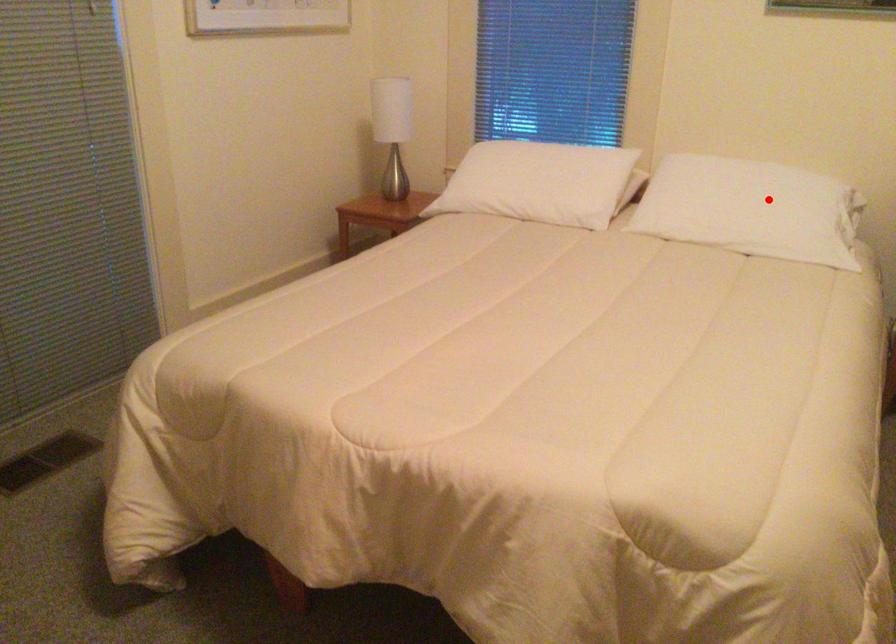
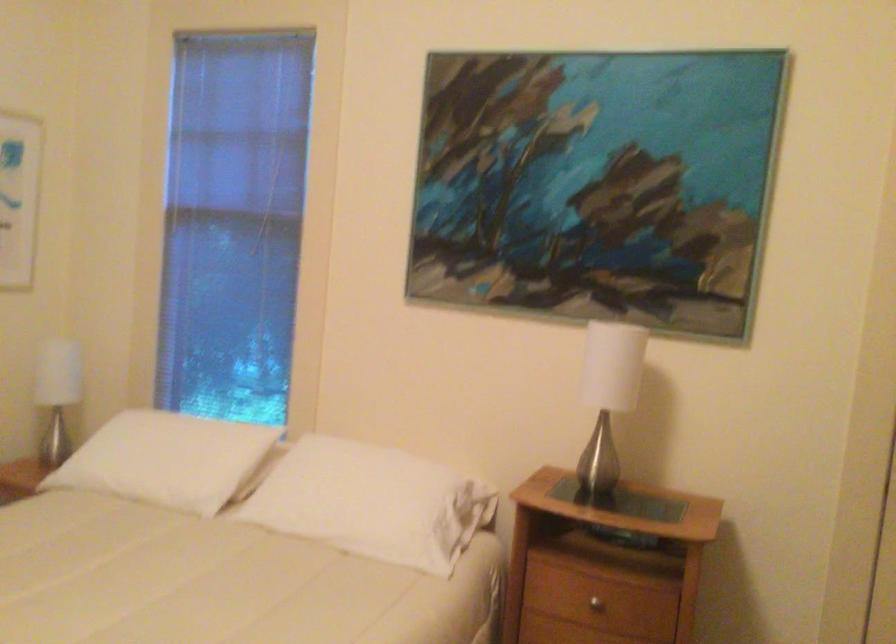
Question: I am providing you with two images of the same scene from different viewpoints. A red point is marked on the first image. Is the red point's position out of view in image 2?

Choices:
 (A) Yes
 (B) No

Answer: (B)